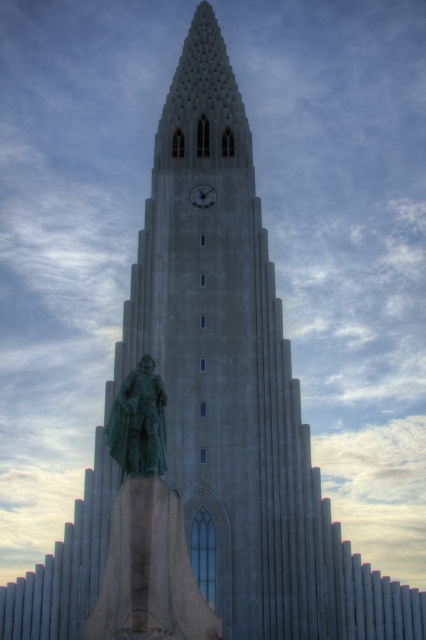
You are an architect analyzing the layout of this structure. Which object is positioned to the left of the other between the green patina statue at center and the metallic gray clock at upper center?

The green patina statue at center is positioned to the left of the metallic gray clock at upper center.

You are an architect analyzing the proportions of the structure. Which object, the green patina statue at center or the metallic gray clock at upper center, takes up more visual space in the composition?

The green patina statue at center takes up more visual space in the composition because it is larger in size than the metallic gray clock at upper center.